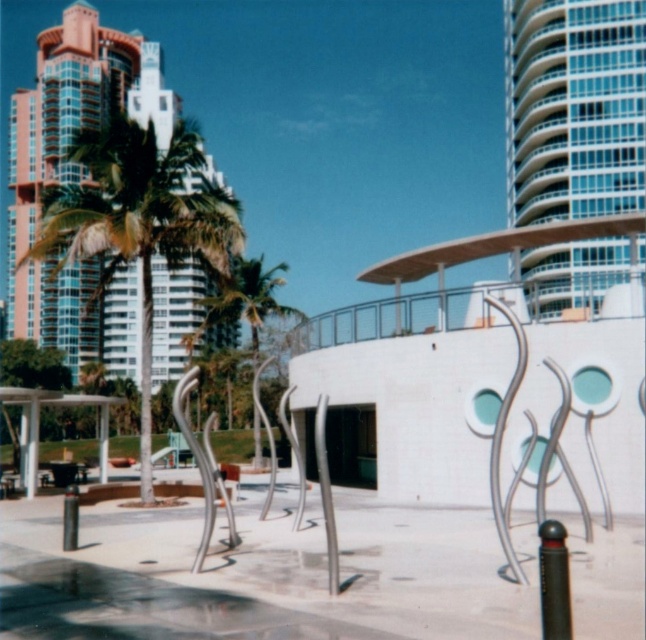
Is green leafy palm tree at left positioned before green leafy palm tree at center?

Yes, green leafy palm tree at left is closer to the viewer.

Does point (198, 186) lie behind point (240, 275)?

Yes, point (198, 186) is behind point (240, 275).

Measure the distance between point (172, 240) and camera.

Point (172, 240) and camera are 74.59 feet apart.

This screenshot has height=640, width=646. What are the coordinates of `green leafy palm tree at left` in the screenshot? It's located at click(140, 224).